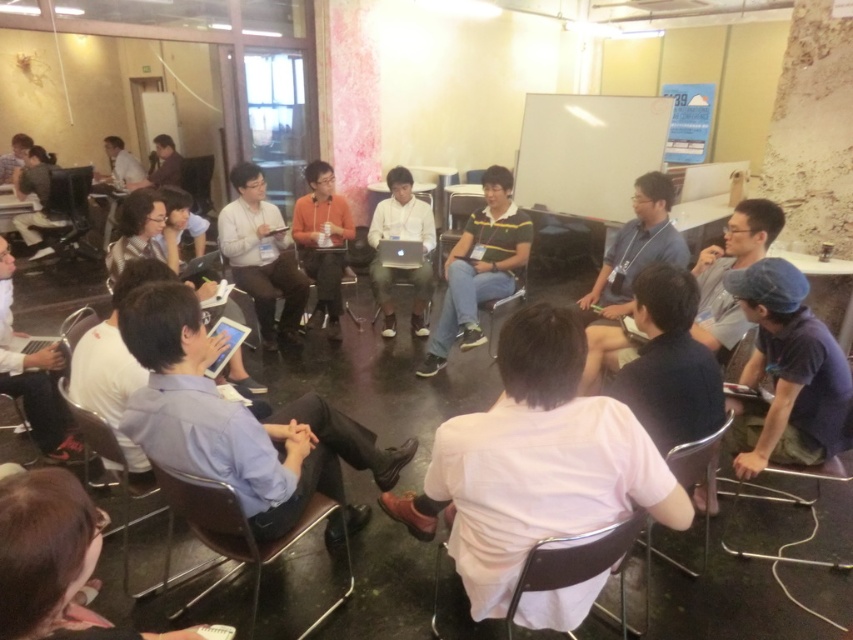
Which is in front, point (183, 330) or point (286, 252)?

Point (183, 330)

Between light blue fabric shirt at center and matte black shirt at center, which one appears on the right side from the viewer's perspective?

From the viewer's perspective, light blue fabric shirt at center appears more on the right side.

Does point (271, 456) come in front of point (289, 289)?

Yes, point (271, 456) is closer to viewer.

At what (x,y) coordinates should I click in order to perform the action: click on light blue fabric shirt at center. Please return your answer as a coordinate pair (x, y). Looking at the image, I should click on (235, 420).

Is point (125, 506) positioned in front of point (68, 321)?

Yes.

What do you see at coordinates (119, 468) in the screenshot?
I see `metallic gray chair at lower left` at bounding box center [119, 468].

You are a GUI agent. You are given a task and a screenshot of the screen. Output one action in this format:
    pyautogui.click(x=<x>, y=<y>)
    Task: Click on the metallic gray chair at lower left
    
    Given the screenshot: What is the action you would take?
    pyautogui.click(x=119, y=468)

From the picture: Is light blue fabric shirt at center above matte black chair at lower left?

Incorrect, light blue fabric shirt at center is not positioned above matte black chair at lower left.

Is point (267, 442) farther from camera compared to point (86, 326)?

No.

Is point (131, 436) in front of point (71, 416)?

Yes, it is.

Find the location of a particular element. light blue fabric shirt at center is located at coordinates click(235, 420).